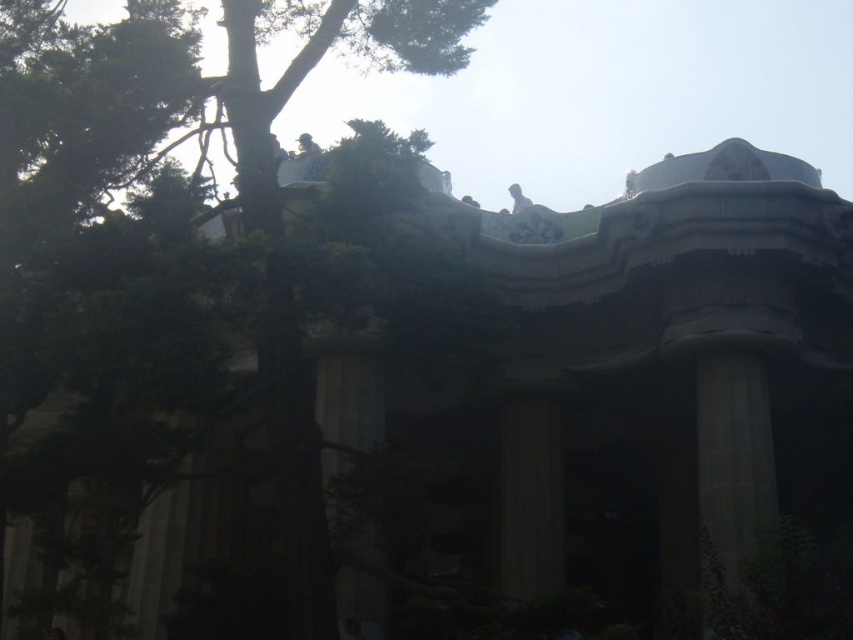
You are an architect examining this classical building. You notice the smooth stone column at center and the light brown wooden statue at upper center. Which object is positioned to the right of the other?

The smooth stone column at center is to the right of the light brown wooden statue at upper center.

You are an architect assessing the visibility of the light brown wooden statue at upper center from the main pathway. Considering the green leafy tree at upper left, do you think the statue is fully visible or partially obscured?

The green leafy tree at upper left has a greater height compared to light brown wooden statue at upper center, so the statue is likely partially obscured by the tree.

You are an architect analyzing the building structure. You notice the green leafy tree at upper left and the smooth stone column at center. Which object occupies more space in the image?

The green leafy tree at upper left is bigger than the smooth stone column at center, so it occupies more space in the image.